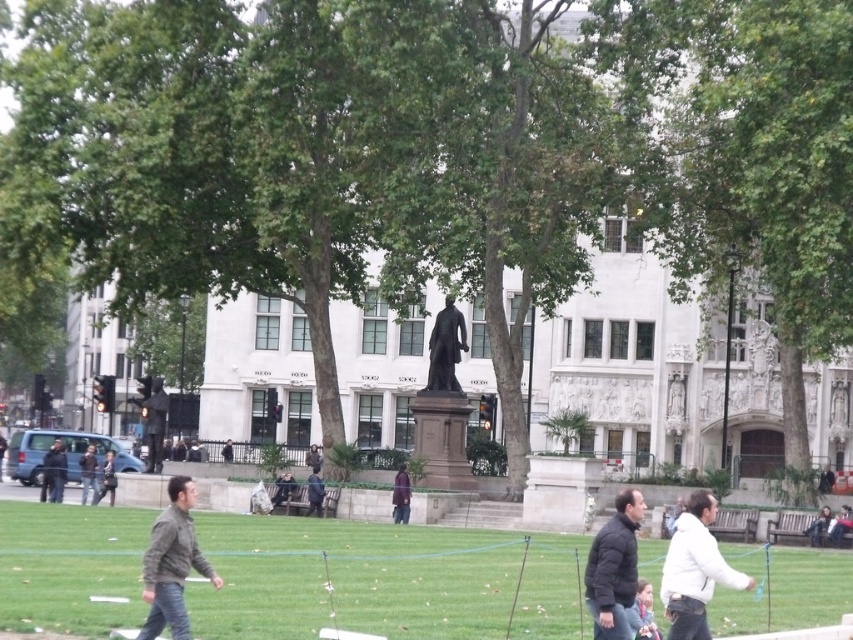
Question: Which point is closer to the camera?

Choices:
 (A) dark gray jacket at lower left
 (B) light brown hair at lower right
 (C) purple fabric jacket at center
 (D) dark blue jacket at center

Answer: (B)

Question: Which point is farther to the camera?

Choices:
 (A) (363, 534)
 (B) (166, 552)
 (C) (403, 481)

Answer: (C)

Question: Can you confirm if green grass at lower center is positioned above dark blue jeans at lower left?

Choices:
 (A) yes
 (B) no

Answer: (B)

Question: Can you confirm if camouflage jacket at lower left is positioned to the left of dark blue jeans at lower left?

Choices:
 (A) no
 (B) yes

Answer: (A)

Question: Can you confirm if dark blue jeans at lower left is positioned below dark blue jacket at center?

Choices:
 (A) yes
 (B) no

Answer: (B)

Question: Among these objects, which one is farthest from the camera?

Choices:
 (A) black polished statue at center
 (B) light brown hair at lower right
 (C) dark gray jacket at lower left

Answer: (A)